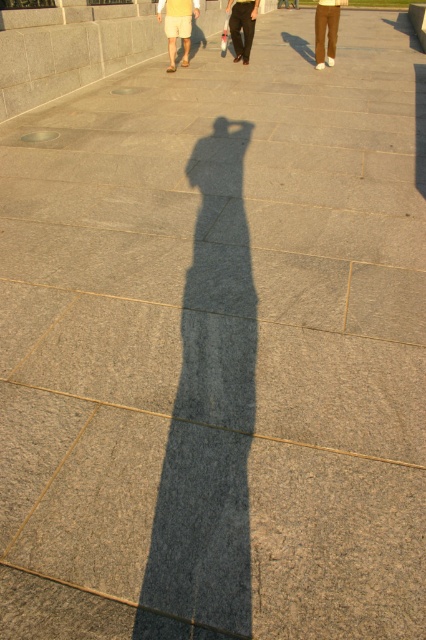
You are standing in the plaza and see the light yellow shorts at upper left and the black smooth pants at center. Which object is taller?

The light yellow shorts at upper left is much taller than the black smooth pants at center.

You are standing in the plaza and want to walk from the point at coordinates (x=166, y=19) to the point at (x=316, y=22). Which direction should you move relative to your current position?

You should move backward because point (x=316, y=22) is further away from the viewer compared to point (x=166, y=19).